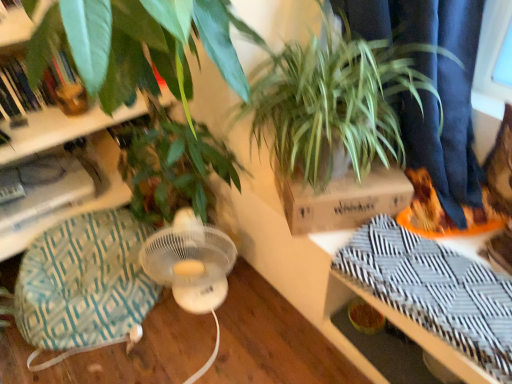
Question: Is green leafy plant at upper right at the left side of green woven swivel chair at lower left?

Choices:
 (A) yes
 (B) no

Answer: (B)

Question: Is green leafy plant at upper right positioned in front of green woven swivel chair at lower left?

Choices:
 (A) no
 (B) yes

Answer: (B)

Question: Considering the relative sizes of green leafy plant at upper right and green woven swivel chair at lower left in the image provided, is green leafy plant at upper right shorter than green woven swivel chair at lower left?

Choices:
 (A) no
 (B) yes

Answer: (A)

Question: From a real-world perspective, is green leafy plant at upper right beneath green woven swivel chair at lower left?

Choices:
 (A) no
 (B) yes

Answer: (A)

Question: Is green leafy plant at upper right positioned far away from green woven swivel chair at lower left?

Choices:
 (A) yes
 (B) no

Answer: (B)

Question: From their relative heights in the image, would you say green leafy plant at upper right is taller or shorter than orange matte shoe at right?

Choices:
 (A) tall
 (B) short

Answer: (A)

Question: From a real-world perspective, is green leafy plant at upper right positioned above or below orange matte shoe at right?

Choices:
 (A) below
 (B) above

Answer: (B)

Question: In the image, is green leafy plant at upper right positioned in front of or behind orange matte shoe at right?

Choices:
 (A) behind
 (B) front

Answer: (B)

Question: Does point (298, 115) appear closer or farther from the camera than point (486, 218)?

Choices:
 (A) closer
 (B) farther

Answer: (A)

Question: Visually, is green leafy plant at upper right positioned to the left or to the right of green woven swivel chair at lower left?

Choices:
 (A) left
 (B) right

Answer: (B)

Question: From a real-world perspective, is green leafy plant at upper right positioned above or below green woven swivel chair at lower left?

Choices:
 (A) below
 (B) above

Answer: (B)

Question: Relative to green woven swivel chair at lower left, is green leafy plant at upper right in front or behind?

Choices:
 (A) behind
 (B) front

Answer: (B)

Question: From the image's perspective, relative to green woven swivel chair at lower left, is green leafy plant at upper right above or below?

Choices:
 (A) above
 (B) below

Answer: (A)

Question: Is orange matte shoe at right inside the boundaries of brown cardboard box at upper center, or outside?

Choices:
 (A) inside
 (B) outside

Answer: (B)

Question: Considering the positions of orange matte shoe at right and brown cardboard box at upper center in the image, is orange matte shoe at right wider or thinner than brown cardboard box at upper center?

Choices:
 (A) thin
 (B) wide

Answer: (A)